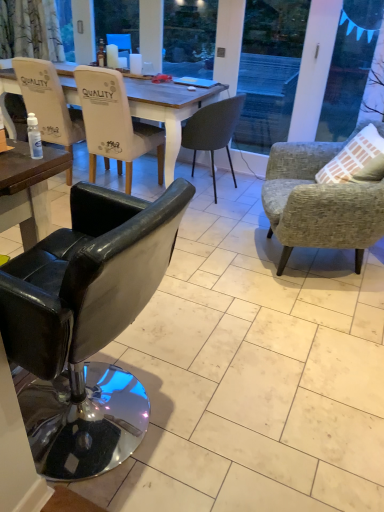
Question: Is black leather chair at left, arranged as the third chair when viewed from the right, bigger or smaller than white glossy coffee cup at upper center?

Choices:
 (A) big
 (B) small

Answer: (A)

Question: Does point (6, 315) appear closer or farther from the camera than point (137, 65)?

Choices:
 (A) farther
 (B) closer

Answer: (B)

Question: Which object is positioned closest to the black leather chair at left, arranged as the third chair when viewed from the right?

Choices:
 (A) white leather chair at upper left, the fourth chair from the right
 (B) white glossy coffee cup at upper center
 (C) matte black chair at center, arranged as the second chair when viewed from the right
 (D) transparent plastic bottle at lower left
 (E) white leather chair at left, placed as the 5th chair when sorted from right to left

Answer: (A)

Question: Which object is positioned closest to the black leather chair at left, arranged as the third chair when viewed from the right?

Choices:
 (A) white glossy coffee cup at upper center
 (B) matte black chair at center, the 4th chair from the left
 (C) white leather chair at upper left, the fourth chair from the right
 (D) white leather chair at left, placed as the 5th chair when sorted from right to left
 (E) transparent plastic bottle at lower left

Answer: (C)